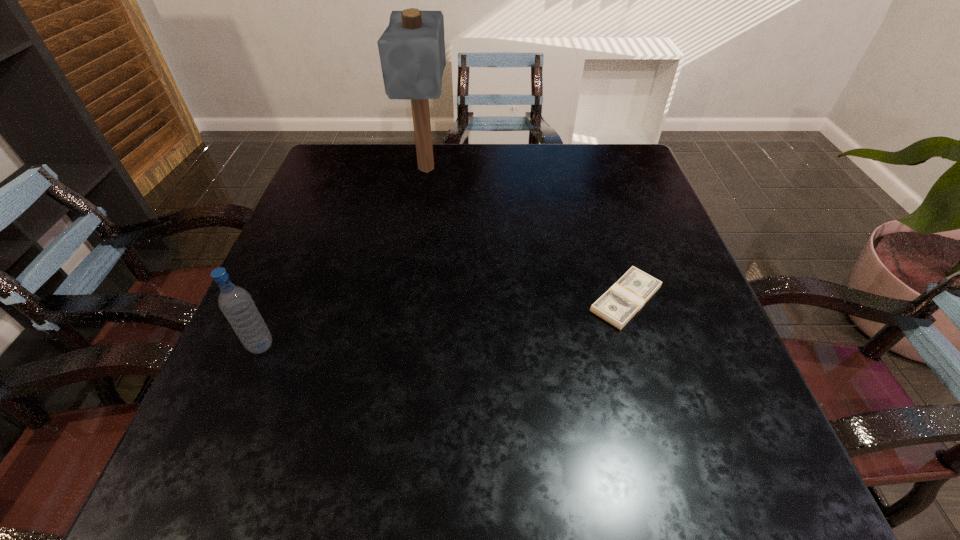
Identify the location of the second closest object relative to the second tallest object. (628, 295).

Locate which object is the closest to the second shortest object. Please provide its 2D coordinates. Your answer should be formatted as a tuple, i.e. [(x, y)], where the tuple contains the x and y coordinates of a point satisfying the conditions above.

[(412, 48)]

Find the location of `vacant space that satisfies the following two spatial constraints: 1. on the front side of the second object from right to left; 2. on the right side of the second nearest object`. vacant space that satisfies the following two spatial constraints: 1. on the front side of the second object from right to left; 2. on the right side of the second nearest object is located at coordinates (406, 299).